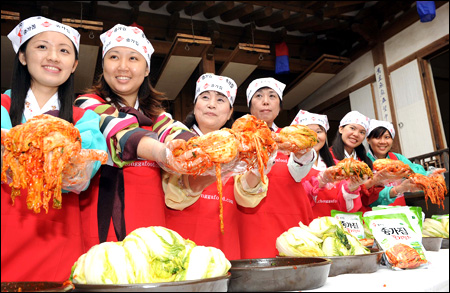
Locate an element on the screen. The width and height of the screenshot is (450, 293). white table is located at coordinates (372, 286).